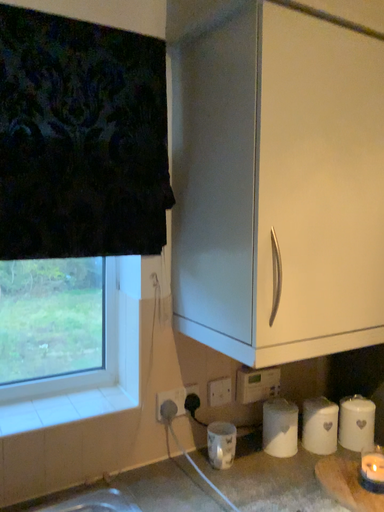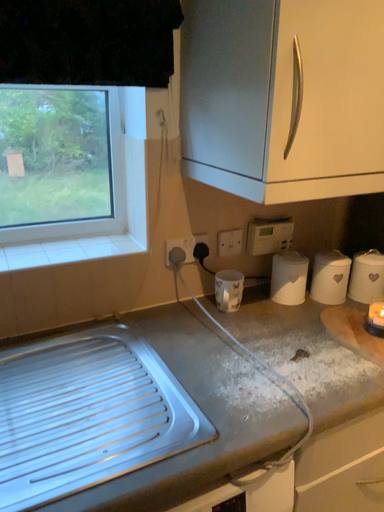
Question: Which way did the camera rotate in the video?

Choices:
 (A) rotated downward
 (B) rotated upward

Answer: (A)